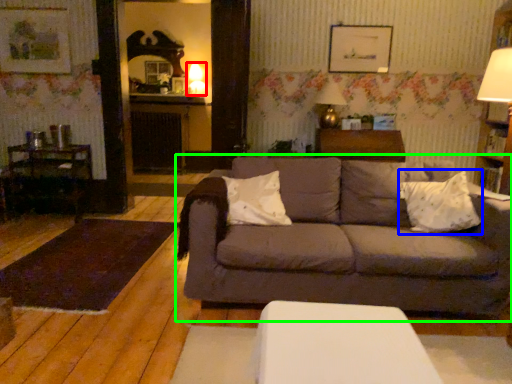
Question: Estimate the real-world distances between objects in this image. Which object is farther from table lamp (highlighted by a red box), throw pillow (highlighted by a blue box) or studio couch (highlighted by a green box)?

Choices:
 (A) throw pillow
 (B) studio couch

Answer: (A)